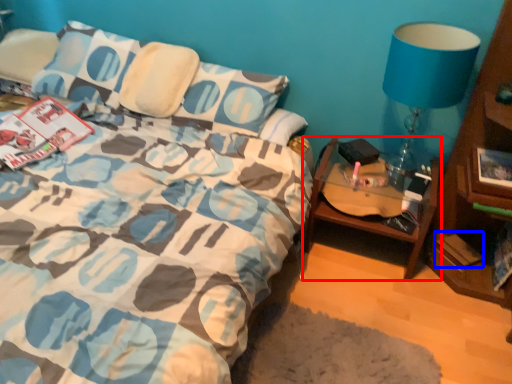
Question: Which of the following is the farthest to the observer, table (highlighted by a red box) or paperback book (highlighted by a blue box)?

Choices:
 (A) table
 (B) paperback book

Answer: (B)